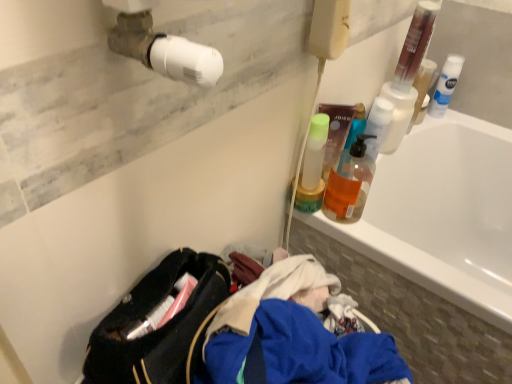
Question: Based on their positions, is translucent orange liquid at upper right located to the left or right of white matte shaving cream can at upper right, which ranks as the 1th cleaning product in back-to-front order?

Choices:
 (A) left
 (B) right

Answer: (A)

Question: From their relative heights in the image, would you say translucent orange liquid at upper right is taller or shorter than white matte shaving cream can at upper right, which is the second cleaning product from bottom to top?

Choices:
 (A) short
 (B) tall

Answer: (A)

Question: Considering the real-world distances, which object is closest to the white matte shaving cream can at upper right, the first cleaning product in the right-to-left sequence?

Choices:
 (A) translucent orange liquid at upper right
 (B) white glossy bathtub at upper right
 (C) translucent plastic pump bottle at upper right, placed as the 2th cleaning product when sorted from right to left

Answer: (B)

Question: Which of these objects is positioned closest to the translucent orange liquid at upper right?

Choices:
 (A) white matte shaving cream can at upper right, the first cleaning product in the right-to-left sequence
 (B) translucent plastic pump bottle at upper right, arranged as the 1th cleaning product when ordered from the bottom
 (C) white glossy bathtub at upper right

Answer: (B)